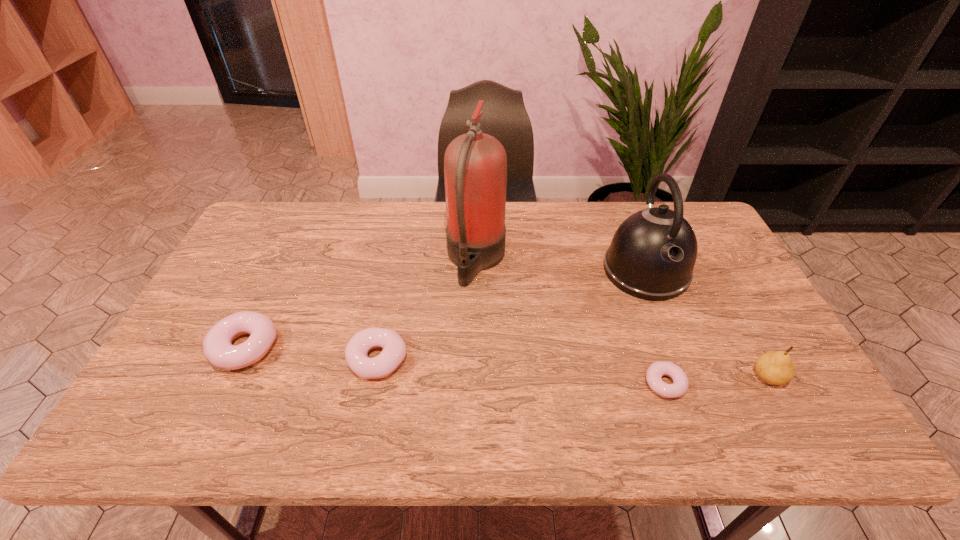
The image size is (960, 540). What are the coordinates of `vacant space situated on the back of the leftmost object` in the screenshot? It's located at (294, 243).

Locate an element on the screen. This screenshot has width=960, height=540. vacant area situated on the left of the second object from left to right is located at coordinates (266, 359).

I want to click on free space located on the back of the shortest object, so click(636, 300).

The height and width of the screenshot is (540, 960). What are the coordinates of `free spot located 0.160m at the nozzle of the tallest object` in the screenshot? It's located at (556, 260).

Identify the location of free region located 0.270m on the spout of the kettle. (692, 389).

The width and height of the screenshot is (960, 540). Find the location of `vacant region located 0.100m on the back of the rightmost object`. vacant region located 0.100m on the back of the rightmost object is located at coordinates (744, 332).

Where is `fire extinguisher that is at the far edge`? The width and height of the screenshot is (960, 540). fire extinguisher that is at the far edge is located at coordinates (475, 164).

The height and width of the screenshot is (540, 960). In order to click on kettle located in the far edge section of the desktop in this screenshot , I will do `click(652, 255)`.

Image resolution: width=960 pixels, height=540 pixels. In order to click on pear located at the near edge in this screenshot , I will do `click(775, 367)`.

You are a GUI agent. You are given a task and a screenshot of the screen. Output one action in this format:
    pyautogui.click(x=<x>, y=<y>)
    Task: Click on the object positioned at the left edge
    
    Given the screenshot: What is the action you would take?
    pyautogui.click(x=218, y=349)